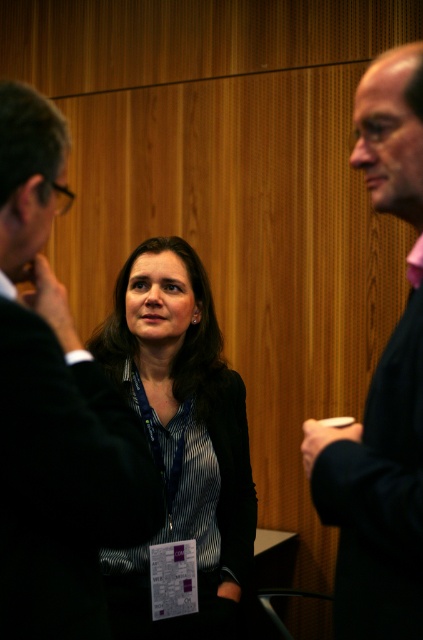
Can you confirm if matte black suit at left is positioned to the right of matte black blazer at center?

In fact, matte black suit at left is to the left of matte black blazer at center.

Between matte black suit at left and matte black blazer at center, which one is positioned higher?

Positioned higher is matte black suit at left.

This screenshot has height=640, width=423. I want to click on matte black suit at left, so click(x=55, y=410).

Does matte black suit at left have a lesser height compared to pink fabric shirt at right?

Correct, matte black suit at left is not as tall as pink fabric shirt at right.

Is matte black suit at left to the left of pink fabric shirt at right from the viewer's perspective?

Correct, you'll find matte black suit at left to the left of pink fabric shirt at right.

Does point (21, 248) come farther from viewer compared to point (376, 488)?

That is True.

This screenshot has width=423, height=640. I want to click on matte black suit at left, so click(x=55, y=410).

Is matte black blazer at center closer to camera compared to pink fabric shirt at right?

No, matte black blazer at center is further to the viewer.

Does matte black blazer at center have a greater height compared to pink fabric shirt at right?

Yes.

Does point (230, 480) come farther from viewer compared to point (340, 451)?

Yes, point (230, 480) is farther from viewer.

At what (x,y) coordinates should I click in order to perform the action: click on matte black blazer at center. Please return your answer as a coordinate pair (x, y). Looking at the image, I should click on (181, 438).